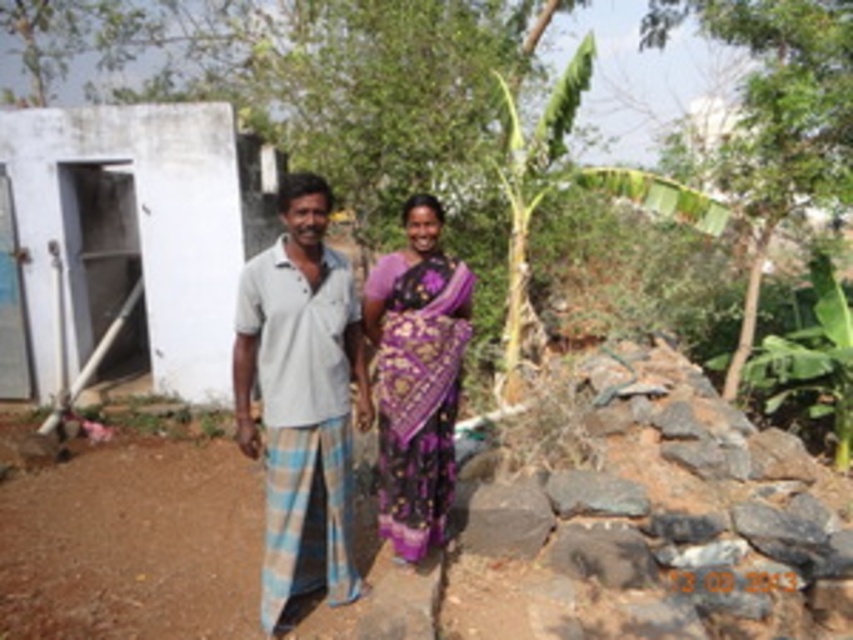
Question: Can you confirm if white concrete hut at left is positioned above purple silk saree at center?

Choices:
 (A) yes
 (B) no

Answer: (A)

Question: Among these points, which one is nearest to the camera?

Choices:
 (A) (125, 177)
 (B) (396, 346)

Answer: (B)

Question: Estimate the real-world distances between objects in this image. Which object is farther from the green leafy banana tree at right?

Choices:
 (A) purple silk saree at center
 (B) purple woven sari at center
 (C) white concrete hut at left
 (D) green leafy tree at upper right

Answer: (B)

Question: Is purple woven sari at center further to camera compared to purple silk saree at center?

Choices:
 (A) no
 (B) yes

Answer: (A)

Question: Estimate the real-world distances between objects in this image. Which object is closer to the green leafy banana tree at right?

Choices:
 (A) purple silk saree at center
 (B) purple woven sari at center
 (C) white concrete hut at left

Answer: (C)

Question: Can you confirm if purple woven sari at center is positioned to the right of green leafy tree at upper right?

Choices:
 (A) no
 (B) yes

Answer: (A)